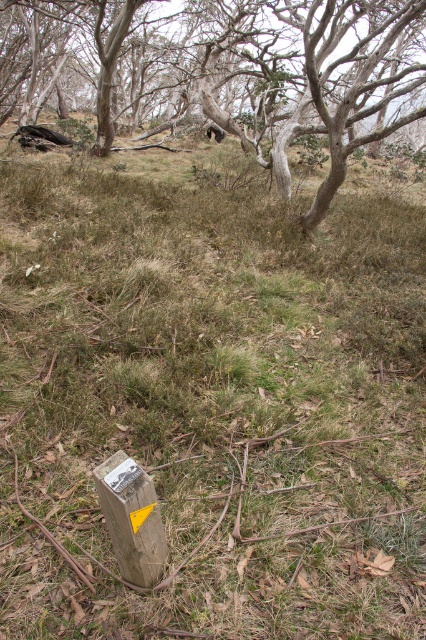
Who is higher up, smooth bark tree at center or wooden post at lower center?

smooth bark tree at center

Does smooth bark tree at center have a lesser width compared to wooden post at lower center?

No.

Which is in front, point (180, 83) or point (97, 492)?

Point (97, 492) is more forward.

Locate an element on the screen. The height and width of the screenshot is (640, 426). smooth bark tree at center is located at coordinates (238, 68).

Is point (181, 58) farther from camera compared to point (103, 481)?

Yes, it is behind point (103, 481).

Which is below, smooth bark tree at center or metallic silver sign at lower center?

metallic silver sign at lower center is lower down.

Which is in front, point (409, 92) or point (108, 476)?

Positioned in front is point (108, 476).

The height and width of the screenshot is (640, 426). In order to click on smooth bark tree at center in this screenshot , I will do `click(238, 68)`.

Is wooden post at lower center positioned before metallic silver sign at lower center?

No, wooden post at lower center is behind metallic silver sign at lower center.

Which is in front, point (123, 490) or point (120, 480)?

Point (123, 490) is more forward.

Locate an element on the screen. wooden post at lower center is located at coordinates pos(132,518).